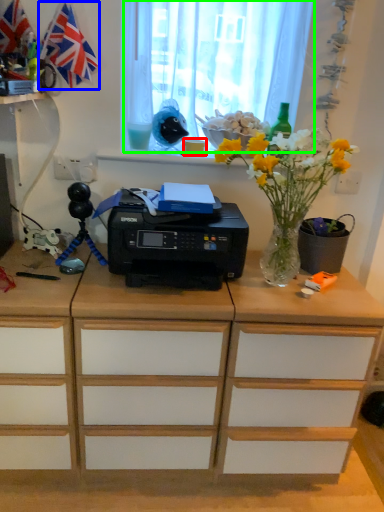
Question: Which object is the closest to the stationery (highlighted by a red box)? Choose among these: flag (highlighted by a blue box) or curtain (highlighted by a green box).

Choices:
 (A) flag
 (B) curtain

Answer: (B)